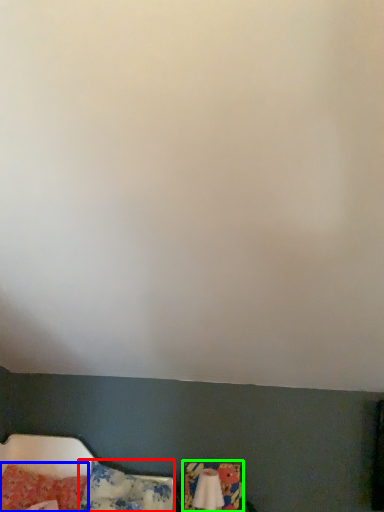
Question: Which is nearer to the pillow (highlighted by a red box)? pillow (highlighted by a blue box) or swivel chair (highlighted by a green box).

Choices:
 (A) pillow
 (B) swivel chair

Answer: (A)